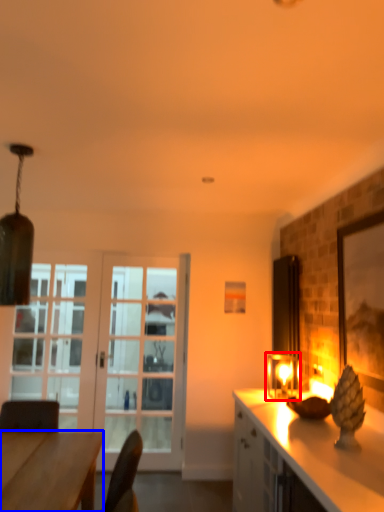
Question: Which of the following is the closest to the observer, light fixture (highlighted by a red box) or desk (highlighted by a blue box)?

Choices:
 (A) light fixture
 (B) desk

Answer: (B)